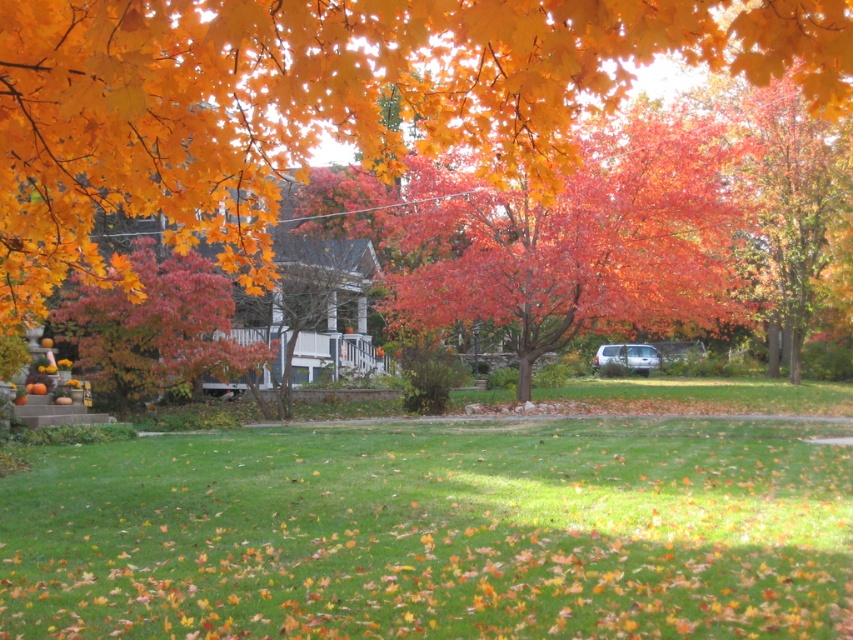
Based on the photo, is orange matte leaves at upper center taller than vivid red leaves at center?

Indeed, orange matte leaves at upper center has a greater height compared to vivid red leaves at center.

Measure the distance from orange matte leaves at upper center to vivid red leaves at center.

3.88 meters

Who is more distant from viewer, (608,45) or (468,232)?

Positioned behind is point (468,232).

Identify the location of orange matte leaves at upper center. (325, 104).

Is point (596, 225) farther from camera compared to point (170, 358)?

Yes, point (596, 225) is behind point (170, 358).

Is vivid red leaves at center smaller than smooth orange tree at center?

No.

Which is behind, point (614, 131) or point (230, 291)?

The point (614, 131) is behind.

Where is `vivid red leaves at center`? This screenshot has width=853, height=640. vivid red leaves at center is located at coordinates tap(577, 244).

I want to click on orange matte leaves at upper center, so click(325, 104).

Who is more forward, [218,198] or [143,342]?

Point [218,198] is more forward.

Locate an element on the screen. orange matte leaves at upper center is located at coordinates (325, 104).

Find the location of `orange matte leaves at upper center`. orange matte leaves at upper center is located at coordinates (325, 104).